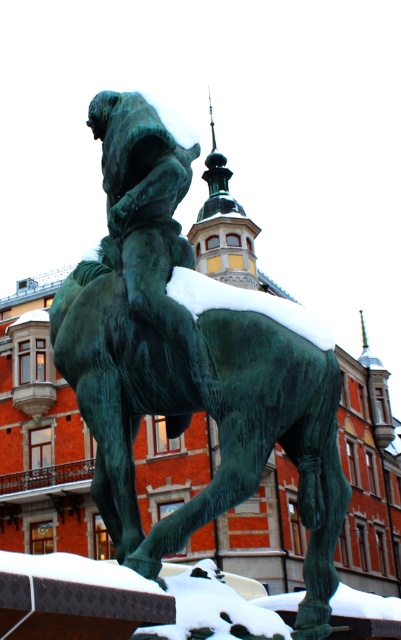
Is green patinated bronze horse at center positioned behind green patinated bronze statue at center?

No, green patinated bronze horse at center is closer to the viewer.

Where is `green patinated bronze horse at center`? Image resolution: width=401 pixels, height=640 pixels. green patinated bronze horse at center is located at coordinates (188, 364).